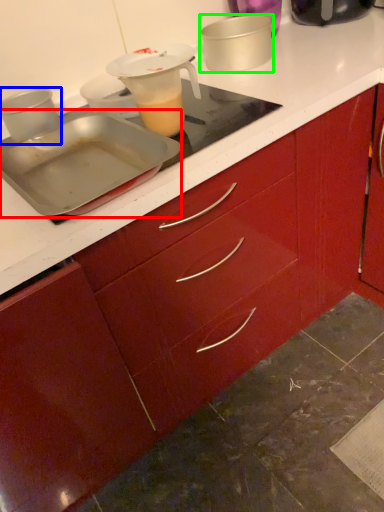
Question: Which is farther away from kitchen appliance (highlighted by a red box)? kitchen appliance (highlighted by a blue box) or kitchen appliance (highlighted by a green box)?

Choices:
 (A) kitchen appliance
 (B) kitchen appliance

Answer: (B)